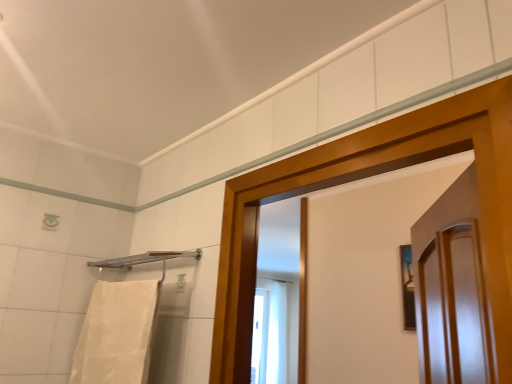
Question: Should I look upward or downward to see white cotton towel at left?

Choices:
 (A) up
 (B) down

Answer: (B)

Question: From a real-world perspective, is white cotton towel at left under silver metallic towel bar at upper left?

Choices:
 (A) no
 (B) yes

Answer: (B)

Question: Can we say white cotton towel at left lies outside silver metallic towel bar at upper left?

Choices:
 (A) no
 (B) yes

Answer: (B)

Question: Is the depth of white cotton towel at left greater than that of silver metallic towel bar at upper left?

Choices:
 (A) no
 (B) yes

Answer: (A)

Question: Is white cotton towel at left thinner than silver metallic towel bar at upper left?

Choices:
 (A) no
 (B) yes

Answer: (B)

Question: Is white cotton towel at left surrounding silver metallic towel bar at upper left?

Choices:
 (A) no
 (B) yes

Answer: (A)

Question: From a real-world perspective, is white cotton towel at left over silver metallic towel bar at upper left?

Choices:
 (A) yes
 (B) no

Answer: (B)

Question: Does silver metallic towel bar at upper left have a smaller size compared to white cotton towel at left?

Choices:
 (A) yes
 (B) no

Answer: (A)

Question: Is silver metallic towel bar at upper left aimed at white cotton towel at left?

Choices:
 (A) yes
 (B) no

Answer: (B)

Question: Is silver metallic towel bar at upper left bigger than white cotton towel at left?

Choices:
 (A) yes
 (B) no

Answer: (B)

Question: From the image's perspective, is silver metallic towel bar at upper left located beneath white cotton towel at left?

Choices:
 (A) no
 (B) yes

Answer: (A)

Question: Is silver metallic towel bar at upper left surrounding white cotton towel at left?

Choices:
 (A) yes
 (B) no

Answer: (B)

Question: Is silver metallic towel bar at upper left positioned with its back to white cotton towel at left?

Choices:
 (A) yes
 (B) no

Answer: (B)

Question: Is white cotton towel at left to the left or to the right of silver metallic towel bar at upper left in the image?

Choices:
 (A) left
 (B) right

Answer: (A)